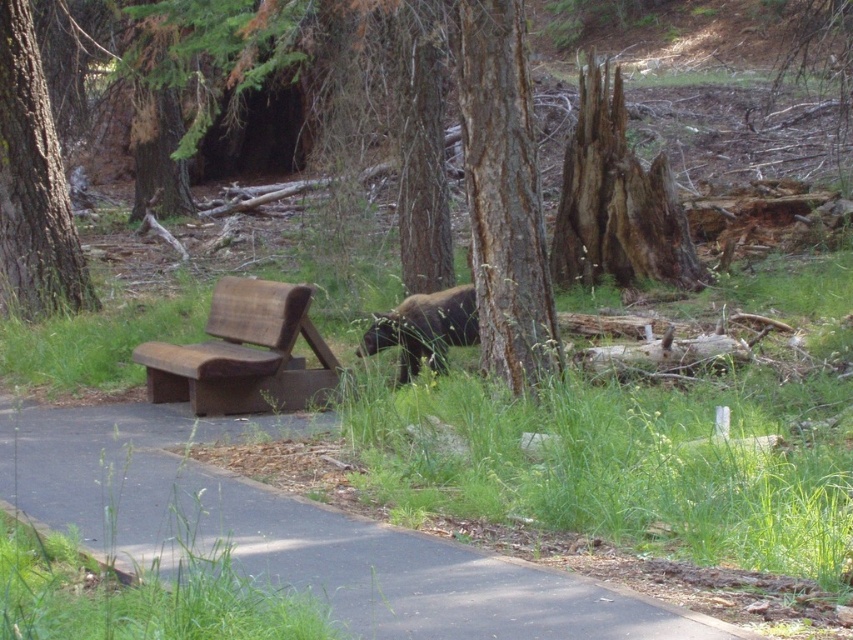
Question: Estimate the real-world distances between objects in this image. Which object is farther from the brown furry bear at center?

Choices:
 (A) brown rough bark tree at left
 (B) black asphalt pavement at lower left
 (C) rough bark tree at center

Answer: (B)

Question: Does black asphalt pavement at lower left have a smaller size compared to brown furry bear at center?

Choices:
 (A) no
 (B) yes

Answer: (B)

Question: Does brown wooden bench at left lie in front of brown furry bear at center?

Choices:
 (A) yes
 (B) no

Answer: (A)

Question: Which of the following is the farthest from the observer?

Choices:
 (A) brown rough bark tree at left
 (B) rough bark tree at center
 (C) brown furry bear at center
 (D) black asphalt pavement at lower left

Answer: (A)

Question: Does brown rough bark tree at left appear over brown wooden bench at left?

Choices:
 (A) yes
 (B) no

Answer: (A)

Question: Which object is positioned closest to the brown rough bark tree at left?

Choices:
 (A) brown furry bear at center
 (B) rough bark tree at center
 (C) black asphalt pavement at lower left
 (D) brown wooden bench at left

Answer: (D)